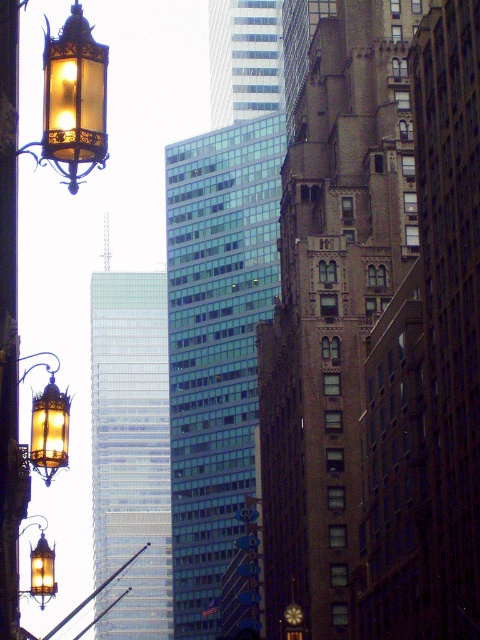
You are standing at the point marked as point [84,35]. You need to walk to the nearest building in the midground. How far will you have to walk?

The distance between the point [84,35] and the nearest building in the midground is 27.52 meters, so you will have to walk 27.52 meters.

You are an architect designing a lighting plan for the cityscape. You need to place a new light pole between the matte glass lantern at upper left and the matte brass lantern at left. Based on their positions, where should the new pole be placed relative to these two lanterns?

The new pole should be placed between the matte glass lantern at upper left and the matte brass lantern at left, positioned below the matte glass lantern at upper left and above the matte brass lantern at left since the matte glass lantern at upper left is above the matte brass lantern at left.